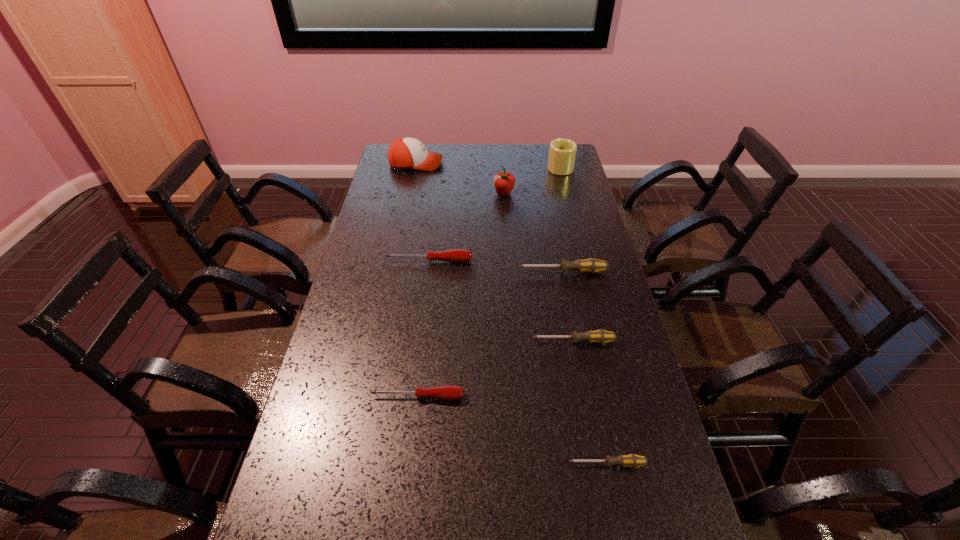
At what (x,y) coordinates should I click in order to perform the action: click on vacant area situated 0.290m at the tip of the farthest gray screwdriver. Please return your answer as a coordinate pair (x, y). Image resolution: width=960 pixels, height=540 pixels. Looking at the image, I should click on (432, 272).

The height and width of the screenshot is (540, 960). Find the location of `blank space located at the tip of the farthest gray screwdriver`. blank space located at the tip of the farthest gray screwdriver is located at coordinates (482, 272).

Image resolution: width=960 pixels, height=540 pixels. I want to click on vacant region located 0.140m on the right of the farthest screwdriver, so click(514, 261).

You are a GUI agent. You are given a task and a screenshot of the screen. Output one action in this format:
    pyautogui.click(x=<x>, y=<y>)
    Task: Click on the vacant space located 0.300m at the tip of the third nearest object
    This screenshot has width=960, height=540.
    Given the screenshot: What is the action you would take?
    pyautogui.click(x=428, y=341)

At what (x,y) coordinates should I click in order to perform the action: click on free location located at the tip of the third nearest object. Please return your answer as a coordinate pair (x, y). The image size is (960, 540). Looking at the image, I should click on (483, 341).

You are a GUI agent. You are given a task and a screenshot of the screen. Output one action in this format:
    pyautogui.click(x=<x>, y=<y>)
    Task: Click on the vacant space situated 0.220m at the tip of the third nearest object
    
    Given the screenshot: What is the action you would take?
    pyautogui.click(x=455, y=341)

Find the location of a particular element. The height and width of the screenshot is (540, 960). free spot located on the right of the nearer red screwdriver is located at coordinates (487, 396).

I want to click on free region located 0.080m at the tip of the smallest gray screwdriver, so click(x=533, y=464).

Locate an element on the screen. free space located at the tip of the smallest gray screwdriver is located at coordinates [538, 464].

The height and width of the screenshot is (540, 960). I want to click on vacant area situated at the tip of the smallest gray screwdriver, so click(434, 464).